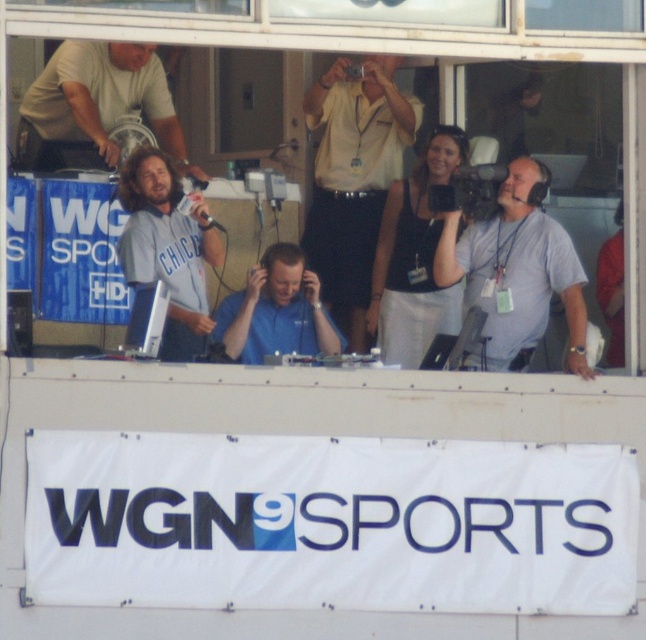
Does transparent glass window at center appear on the left side of blue fabric shirt at center?

No, transparent glass window at center is not to the left of blue fabric shirt at center.

This screenshot has width=646, height=640. Find the location of `transparent glass window at center`. transparent glass window at center is located at coordinates (359, 51).

Find the location of a particular element. transparent glass window at center is located at coordinates (359, 51).

Can you confirm if matte gray shirt at center is thinner than blue fabric shirt at center?

Yes, matte gray shirt at center is thinner than blue fabric shirt at center.

Between matte gray shirt at center and blue fabric shirt at center, which one has more height?

With more height is matte gray shirt at center.

The width and height of the screenshot is (646, 640). What do you see at coordinates (169, 248) in the screenshot?
I see `matte gray shirt at center` at bounding box center [169, 248].

You are a GUI agent. You are given a task and a screenshot of the screen. Output one action in this format:
    pyautogui.click(x=<x>, y=<y>)
    Task: Click on the matte gray shirt at center
    This screenshot has width=646, height=640.
    Given the screenshot: What is the action you would take?
    pyautogui.click(x=169, y=248)

Can you confirm if yellow shirt at center is thinner than gray fabric camera at right?

In fact, yellow shirt at center might be wider than gray fabric camera at right.

Is yellow shirt at center positioned behind gray fabric camera at right?

Yes, it is behind gray fabric camera at right.

Is point (368, 284) in front of point (576, 276)?

That is False.

Where is `yellow shirt at center`? Image resolution: width=646 pixels, height=640 pixels. yellow shirt at center is located at coordinates (353, 179).